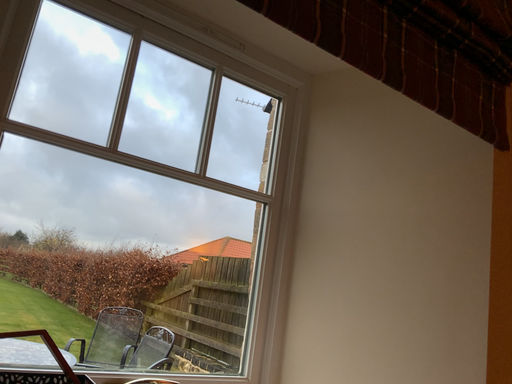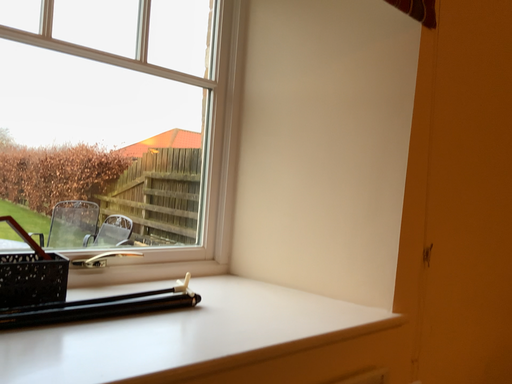
Question: Which way did the camera rotate in the video?

Choices:
 (A) rotated left
 (B) rotated right

Answer: (B)